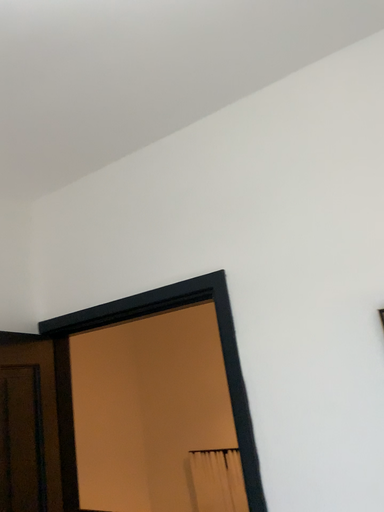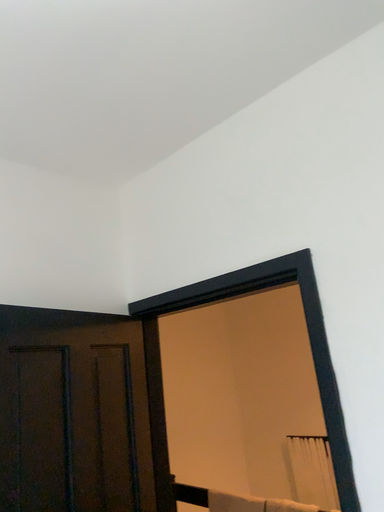
Question: Which way did the camera rotate in the video?

Choices:
 (A) rotated right
 (B) rotated left

Answer: (B)